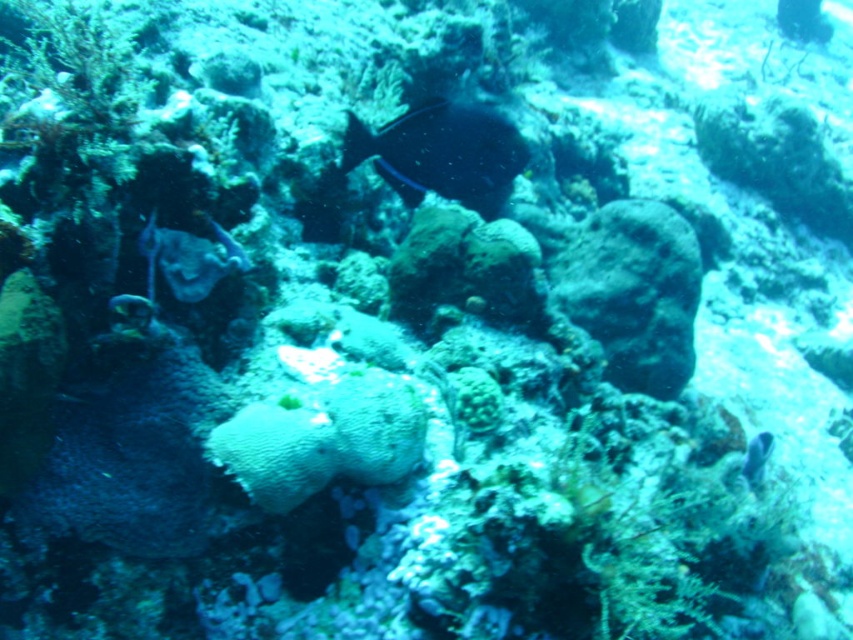
You are a scuba diver observing the underwater scene. You see the shiny black fish at center and the shiny blue fish at lower right. Which fish appears larger in your view?

The shiny black fish at center appears larger because it is closer to the viewer than the shiny blue fish at lower right.

You are a marine biologist observing an underwater scene. You notice two fish, the shiny black fish at center and the shiny blue fish at lower right. Based on their sizes, which fish would cast a larger shadow on the seafloor when sunlight filters through the water?

The shiny black fish at center has a greater width than the shiny blue fish at lower right, so it would cast a larger shadow on the seafloor.

You are a marine biologist observing an underwater scene. You notice two fish, the shiny black fish at center and the shiny blue fish at lower right. Which fish appears taller in the image?

The shiny black fish at center appears taller than the shiny blue fish at lower right.